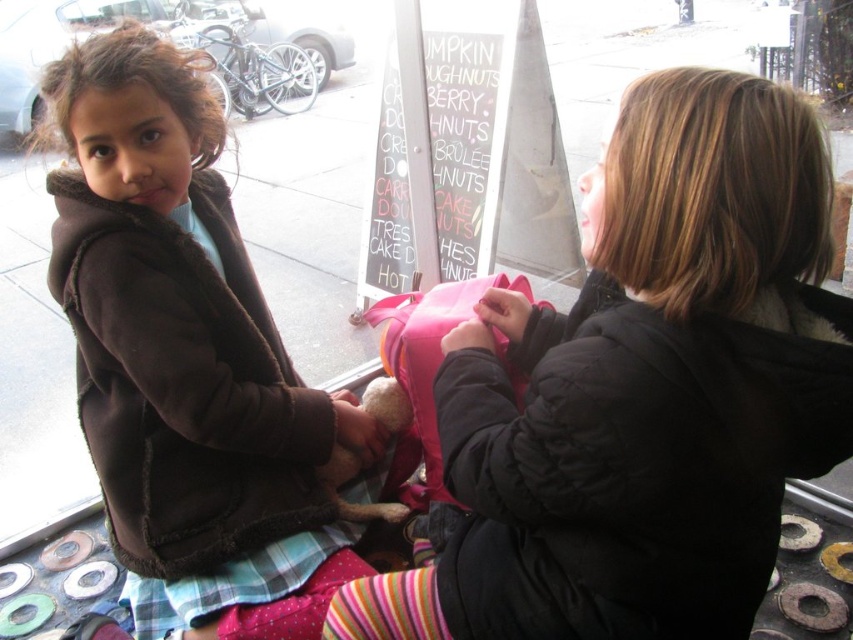
Question: Does matte pink backpack at center appear on the left side of brown fuzzy jacket at left?

Choices:
 (A) no
 (B) yes

Answer: (A)

Question: Observing the image, what is the correct spatial positioning of matte pink backpack at center in reference to striped cotton sock at lower center?

Choices:
 (A) below
 (B) above

Answer: (B)

Question: Estimate the real-world distances between objects in this image. Which object is closer to the striped cotton sock at lower center?

Choices:
 (A) matte pink backpack at center
 (B) brown fuzzy jacket at left

Answer: (A)

Question: Does matte pink backpack at center appear on the left side of brown fuzzy jacket at left?

Choices:
 (A) no
 (B) yes

Answer: (A)

Question: Which point is closer to the camera taking this photo?

Choices:
 (A) (163, 138)
 (B) (419, 572)
 (C) (531, 317)

Answer: (B)

Question: Estimate the real-world distances between objects in this image. Which object is closer to the matte pink backpack at center?

Choices:
 (A) brown fuzzy jacket at left
 (B) striped cotton sock at lower center

Answer: (B)